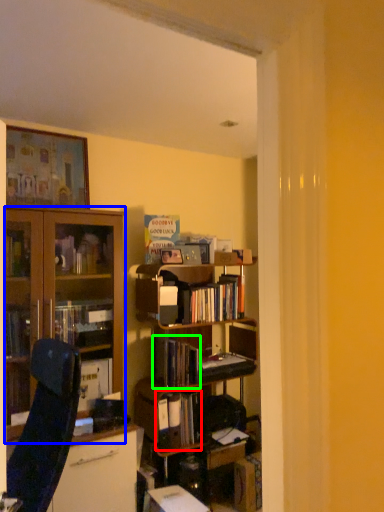
Question: Considering the real-world distances, which object is farthest from book (highlighted by a red box)? cabinetry (highlighted by a blue box) or book (highlighted by a green box)?

Choices:
 (A) cabinetry
 (B) book

Answer: (A)